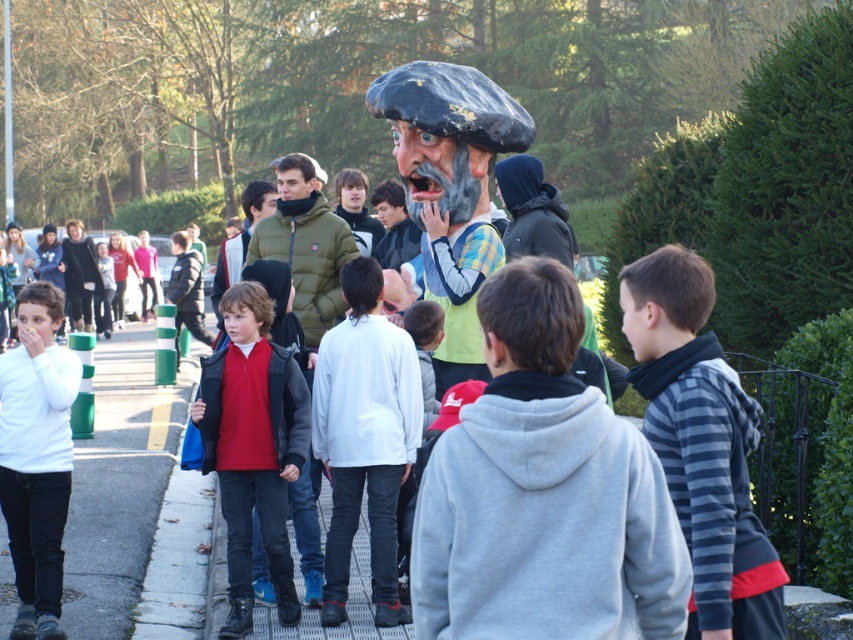
Between white matte jacket at center and matte red shirt at center, which one appears on the left side from the viewer's perspective?

Positioned to the left is matte red shirt at center.

Between white matte jacket at center and matte red shirt at center, which one is positioned higher?

white matte jacket at center

The image size is (853, 640). Identify the location of white matte jacket at center. (364, 436).

The image size is (853, 640). What are the coordinates of `white matte jacket at center` in the screenshot? It's located at (364, 436).

Which is behind, point (335, 596) or point (469, 225)?

Positioned behind is point (469, 225).

Image resolution: width=853 pixels, height=640 pixels. Describe the element at coordinates (364, 436) in the screenshot. I see `white matte jacket at center` at that location.

At what (x,y) coordinates should I click in order to perform the action: click on white matte jacket at center. Please return your answer as a coordinate pair (x, y). This screenshot has height=640, width=853. Looking at the image, I should click on (364, 436).

Where is `white matte jacket at center`? The height and width of the screenshot is (640, 853). white matte jacket at center is located at coordinates (364, 436).

Between point (111, 561) and point (341, 499), which one is positioned in front?

Positioned in front is point (341, 499).

Who is lower down, gray concrete pavement at left or white matte jacket at center?

gray concrete pavement at left

Who is more distant from viewer, (109, 632) or (399, 432)?

Point (109, 632)

Image resolution: width=853 pixels, height=640 pixels. In order to click on gray concrete pavement at left in this screenshot , I will do 120,483.